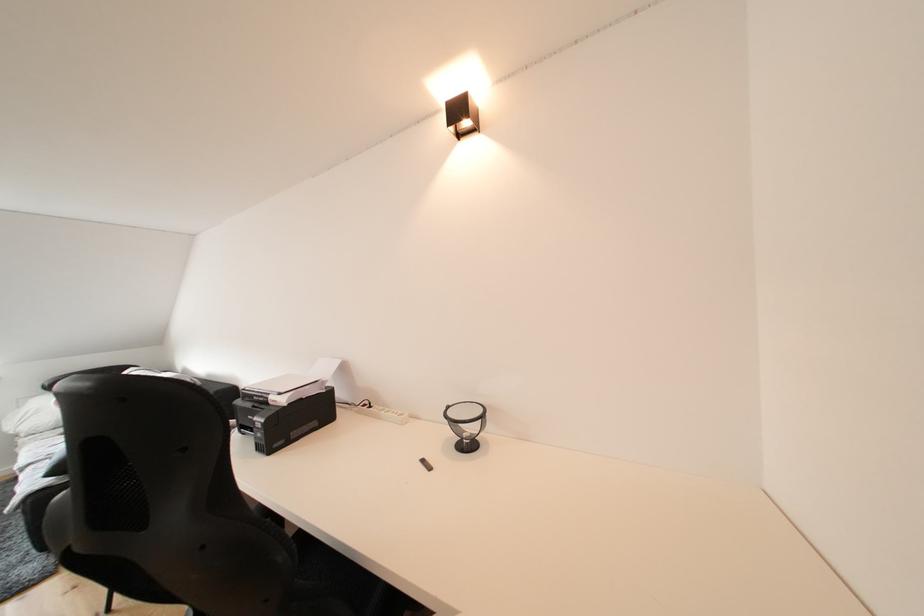
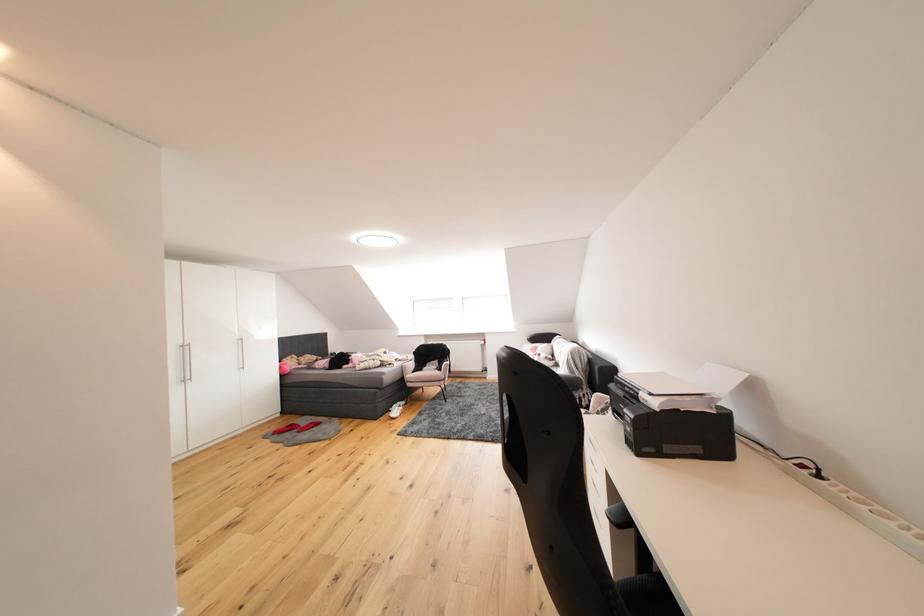
The point at (289, 398) is marked in the first image. Where is the corresponding point in the second image?

(661, 398)